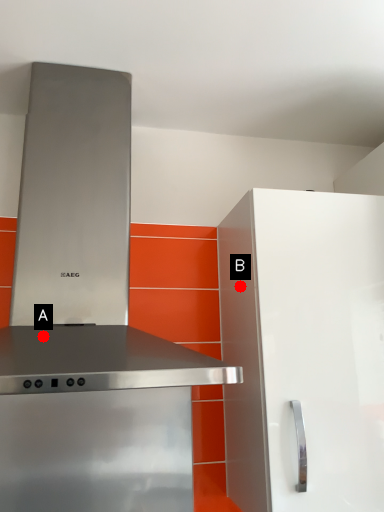
Question: Two points are circled on the image, labeled by A and B beside each circle. Which of the following is the farthest from the observer?

Choices:
 (A) A is further
 (B) B is further

Answer: (B)